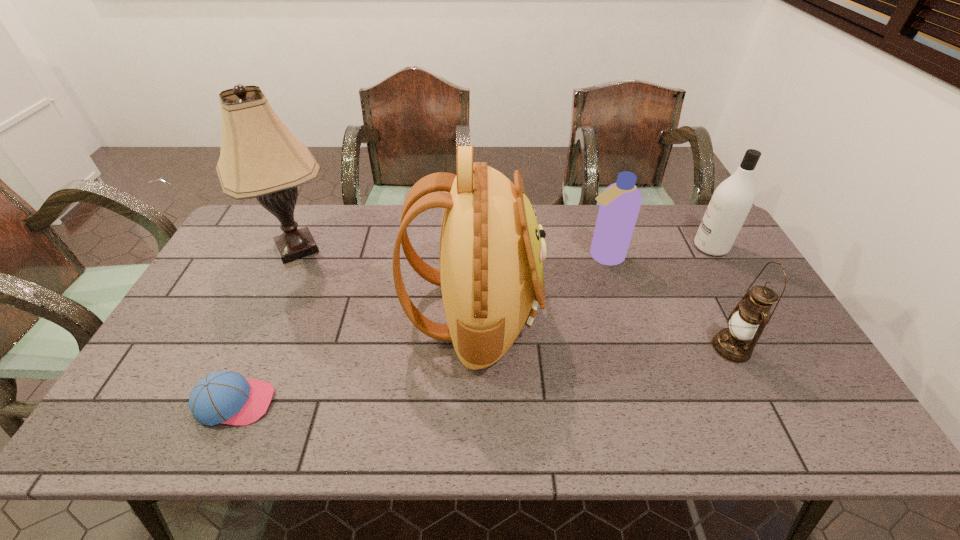
This screenshot has height=540, width=960. Find the location of `oil lamp situated at the right edge`. oil lamp situated at the right edge is located at coordinates (747, 321).

At what (x,y) coordinates should I click in order to perform the action: click on object located at the far left corner. Please return your answer as a coordinate pair (x, y). Image resolution: width=960 pixels, height=540 pixels. Looking at the image, I should click on (260, 158).

I want to click on object located in the near left corner section of the desktop, so click(x=226, y=397).

At what (x,y) coordinates should I click in order to perform the action: click on object that is at the far right corner. Please return your answer as a coordinate pair (x, y). This screenshot has width=960, height=540. Looking at the image, I should click on (732, 200).

You are a GUI agent. You are given a task and a screenshot of the screen. Output one action in this format:
    pyautogui.click(x=<x>, y=<y>)
    Task: Click on the free space at the far edge
    The image size is (960, 540).
    Given the screenshot: What is the action you would take?
    pyautogui.click(x=574, y=241)

The height and width of the screenshot is (540, 960). I want to click on vacant space at the near edge of the desktop, so click(271, 433).

Image resolution: width=960 pixels, height=540 pixels. I want to click on free region at the left edge of the desktop, so click(180, 356).

This screenshot has width=960, height=540. In the image, there is a desktop. In order to click on vacant region at the near left corner in this screenshot , I will do `click(180, 413)`.

This screenshot has width=960, height=540. I want to click on vacant space at the far right corner, so click(702, 214).

Find the location of a particular element. This screenshot has width=960, height=540. free region at the near right corner of the desktop is located at coordinates (830, 428).